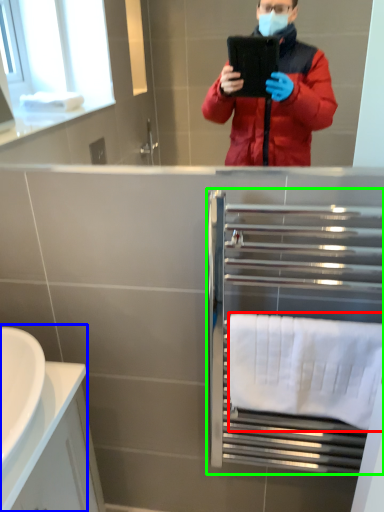
Question: Estimate the real-world distances between objects in this image. Which object is closer to towel/napkin (highlighted by a red box), sink (highlighted by a blue box) or balustrade (highlighted by a green box)?

Choices:
 (A) sink
 (B) balustrade

Answer: (B)